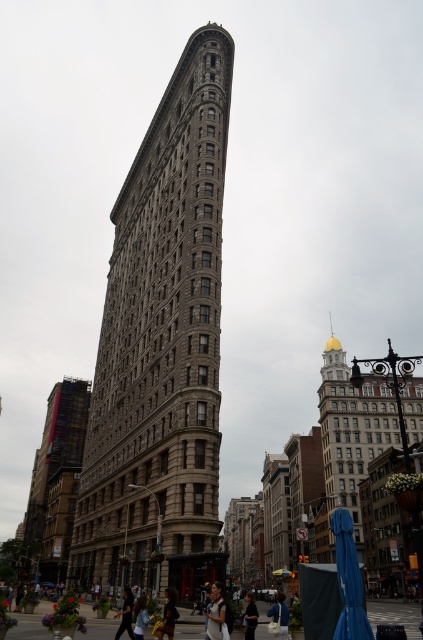
You are standing on the sidewalk in front of the Flatiron Building and notice two points marked on the building facade. The first point is at coordinates point [364,417] and the second is at point [224,624]. Which of these points is closer to your current position?

Point [224,624] is closer to your current position because it is less further to the camera than point [364,417].

Looking at this image, you are standing at the center of the image and want to locate the gold dome building at right. According to the coordinates provided, in which direction should you turn to face it?

The gold dome building at right is located at coordinates point [351,432]. Since the coordinate system is normalized, 0.675 on the x axis is to the right of the center and 0.832 on the y axis is below the center. Therefore, you should turn to your right and look downward to face the gold dome building at right.

You are a photographer standing at the corner of the Flatiron Building. You want to capture a photo that includes both the gold dome building at right and the dark blue jeans at lower center. Which object should you frame first to ensure both are in the shot?

The gold dome building at right is wider than the dark blue jeans at lower center, so you should frame the gold dome building at right first to ensure both are included in the photo.